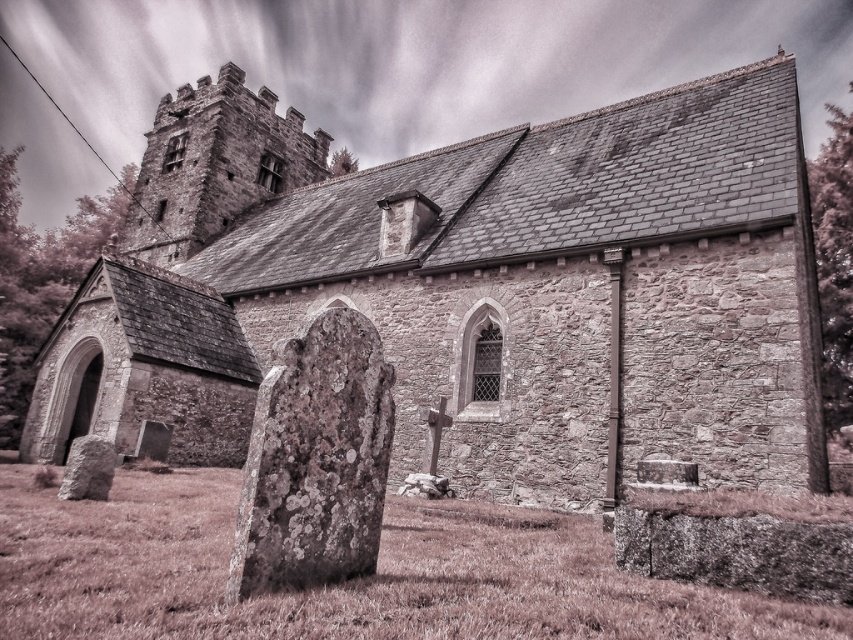
Question: Which point appears closest to the camera in this image?

Choices:
 (A) (109, 468)
 (B) (677, 451)
 (C) (306, 403)

Answer: (C)

Question: Which object is closer to the camera taking this photo?

Choices:
 (A) stone church at center
 (B) lichen-covered stone at center
 (C) rusty stone gravestone at lower left

Answer: (B)

Question: Which of the following is the farthest from the observer?

Choices:
 (A) (293, 378)
 (B) (653, 164)

Answer: (B)

Question: Does lichen-covered stone at center appear on the left side of rusty stone gravestone at lower left?

Choices:
 (A) yes
 (B) no

Answer: (B)

Question: Is stone church at center to the left of lichen-covered stone at center from the viewer's perspective?

Choices:
 (A) yes
 (B) no

Answer: (A)

Question: Does stone church at center have a lesser width compared to lichen-covered stone at center?

Choices:
 (A) yes
 (B) no

Answer: (B)